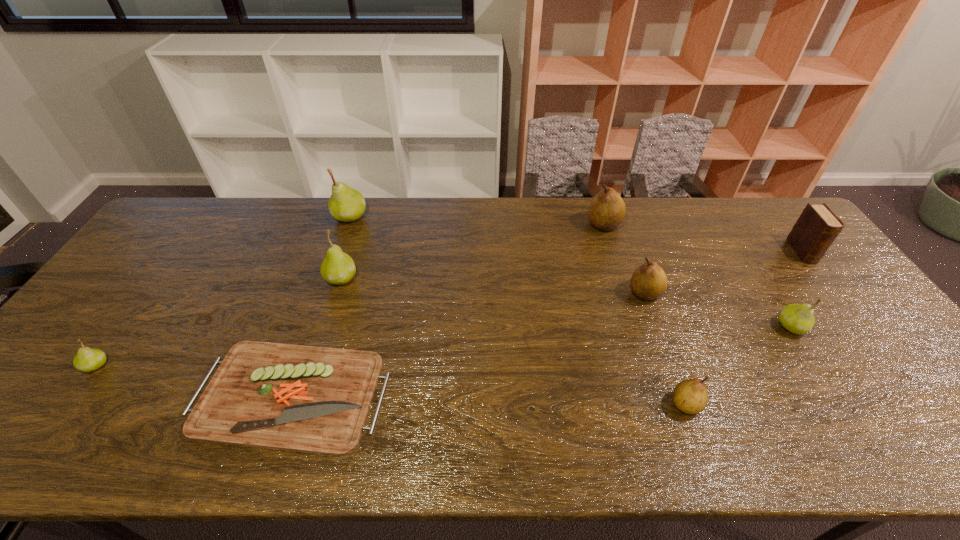
Locate an element on the screen. The height and width of the screenshot is (540, 960). vacant space located 0.090m on the right of the sixth farthest pear is located at coordinates (144, 366).

Locate an element on the screen. vacant point located 0.250m on the right of the nearest brown pear is located at coordinates (809, 404).

Where is `vacant position located 0.100m on the left of the shortest object`? vacant position located 0.100m on the left of the shortest object is located at coordinates point(152,394).

In order to click on diary that is at the far edge in this screenshot , I will do `click(817, 227)`.

You are a GUI agent. You are given a task and a screenshot of the screen. Output one action in this format:
    pyautogui.click(x=<x>, y=<y>)
    Task: Click on the object that is at the near edge
    
    Given the screenshot: What is the action you would take?
    pyautogui.click(x=308, y=399)

Identify the location of object positioned at the left edge. This screenshot has height=540, width=960. (87, 359).

This screenshot has height=540, width=960. Identify the location of object that is positioned at the right edge. (817, 227).

You are a GUI agent. You are given a task and a screenshot of the screen. Output one action in this format:
    pyautogui.click(x=<x>, y=<y>)
    Task: Click on the object that is at the far right corner
    This screenshot has height=540, width=960.
    Given the screenshot: What is the action you would take?
    pyautogui.click(x=817, y=227)

You are a GUI agent. You are given a task and a screenshot of the screen. Output one action in this format:
    pyautogui.click(x=<x>, y=<y>)
    Task: Click on the free location at the far edge of the desktop
    The image size is (960, 540).
    Given the screenshot: What is the action you would take?
    pyautogui.click(x=468, y=208)

Identify the location of vacant space at the near edge of the desktop. The width and height of the screenshot is (960, 540). (760, 453).